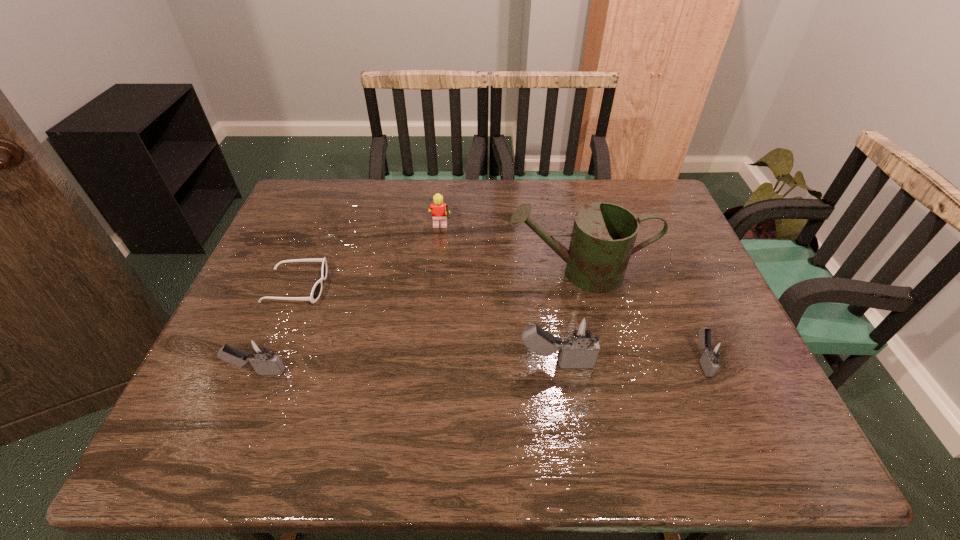
Identify the location of the second shortest igniter. (258, 352).

Identify the location of the second tallest object. The width and height of the screenshot is (960, 540). (578, 348).

Identify the location of the tallest igniter. The image size is (960, 540). (578, 348).

Locate an element on the screen. the rightmost igniter is located at coordinates (714, 350).

This screenshot has height=540, width=960. In order to click on the shortest igniter in this screenshot , I will do `click(714, 350)`.

The image size is (960, 540). Find the location of `sunglasses`. sunglasses is located at coordinates (316, 291).

This screenshot has width=960, height=540. In order to click on the tallest object in this screenshot , I will do `click(603, 236)`.

Locate an element on the screen. The image size is (960, 540). the farthest object is located at coordinates (x=439, y=210).

Find the location of a particular element. the fourth object from right to left is located at coordinates (439, 210).

Where is `vacant area situated on the right of the leftmost igniter`? This screenshot has height=540, width=960. vacant area situated on the right of the leftmost igniter is located at coordinates (325, 372).